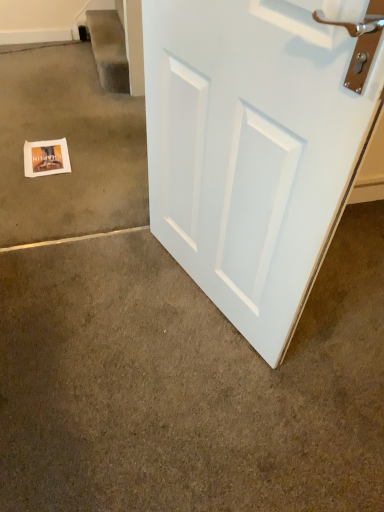
Where is `vacant location below white matte door at right (from a real-world perspective)`? This screenshot has height=512, width=384. vacant location below white matte door at right (from a real-world perspective) is located at coordinates (205, 298).